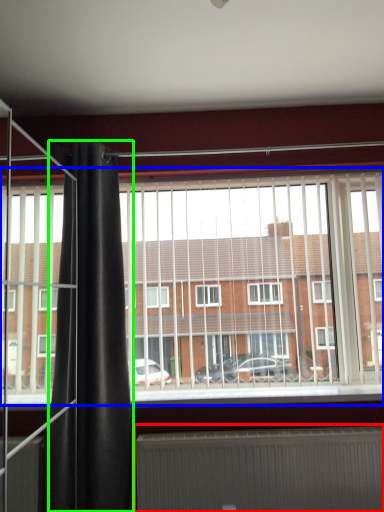
Question: Based on their relative distances, which object is farther from radiator (highlighted by a red box)? Choose from window (highlighted by a blue box) and shower curtain (highlighted by a green box).

Choices:
 (A) window
 (B) shower curtain

Answer: (B)